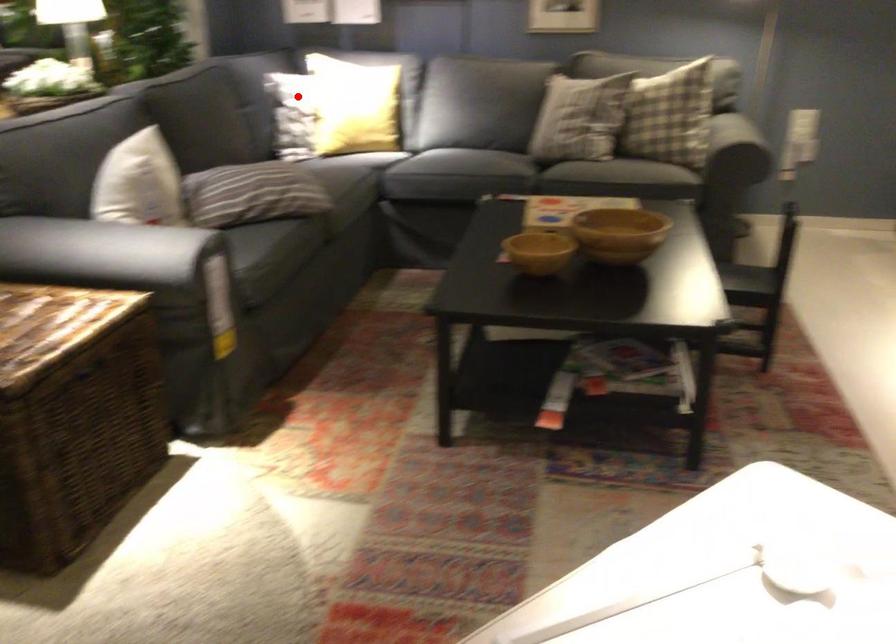
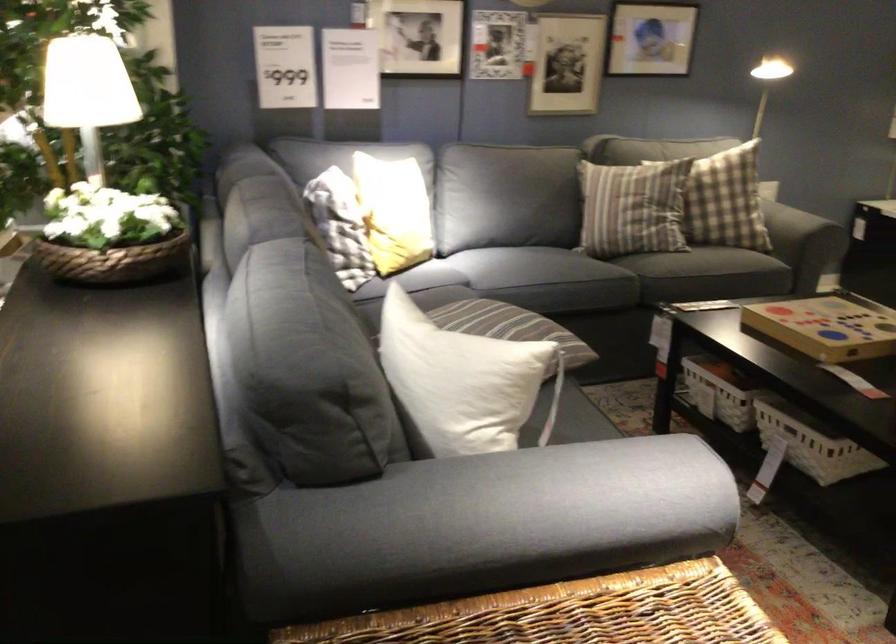
In the second image, find the point that corresponds to the highlighted location in the first image.

(392, 212)